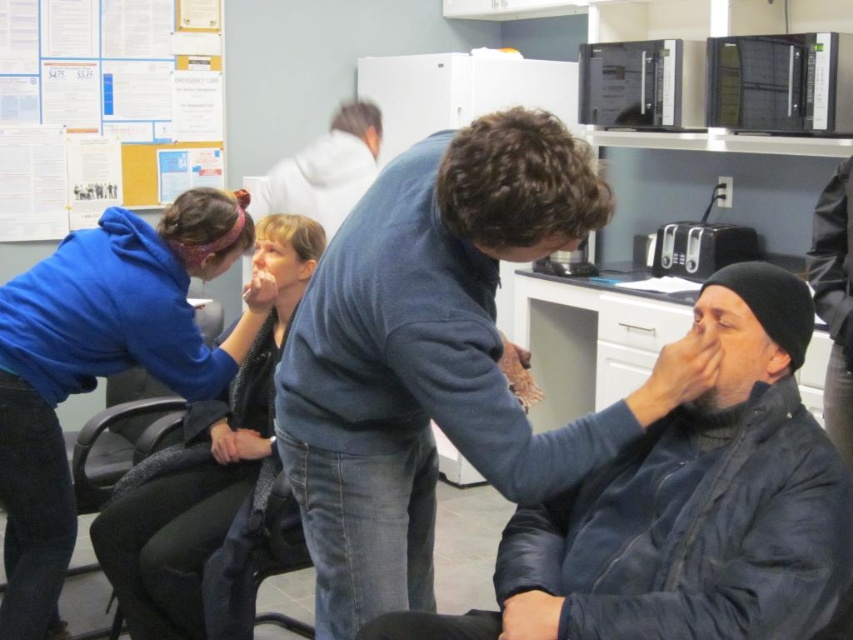
Question: Which object appears farthest from the camera in this image?

Choices:
 (A) matte blue hoodie at left
 (B) blue fleece jacket at upper center
 (C) dark blue jacket at lower right
 (D) dark blue leather jacket at center

Answer: (B)

Question: Is dark blue leather jacket at center smaller than blue fleece jacket at upper center?

Choices:
 (A) yes
 (B) no

Answer: (B)

Question: Is dark blue leather jacket at center below matte blue hoodie at left?

Choices:
 (A) no
 (B) yes

Answer: (A)

Question: Estimate the real-world distances between objects in this image. Which object is closer to the white paperboard at upper left?

Choices:
 (A) dark blue jacket at lower right
 (B) blue fleece jacket at upper center
 (C) dark blue leather jacket at center
 (D) matte blue hoodie at left

Answer: (B)

Question: In this image, where is dark blue jacket at lower right located relative to white paperboard at upper left?

Choices:
 (A) above
 (B) below

Answer: (B)

Question: Considering the real-world distances, which object is closest to the matte blue hoodie at left?

Choices:
 (A) white paperboard at upper left
 (B) blue fleece jacket at upper center
 (C) dark blue jacket at lower right

Answer: (C)